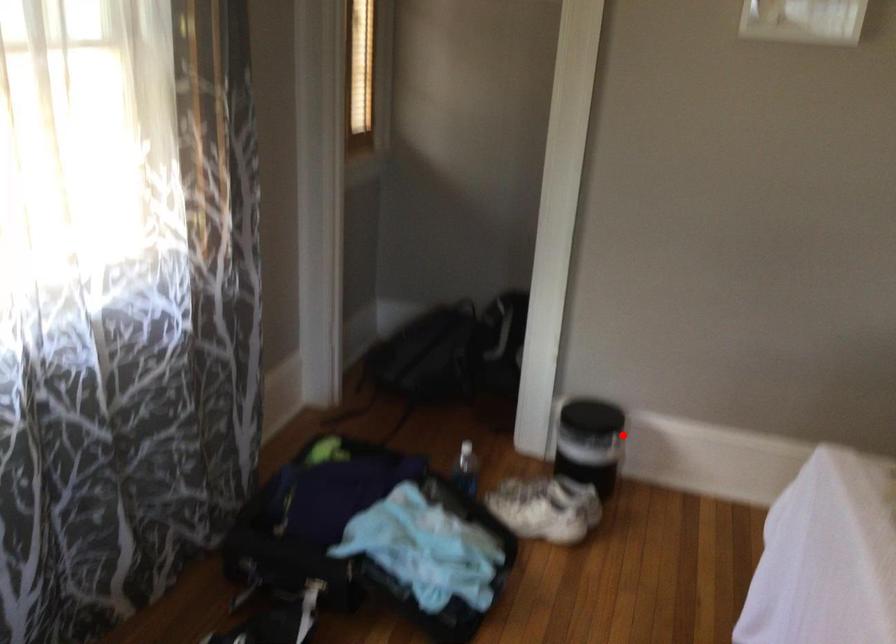
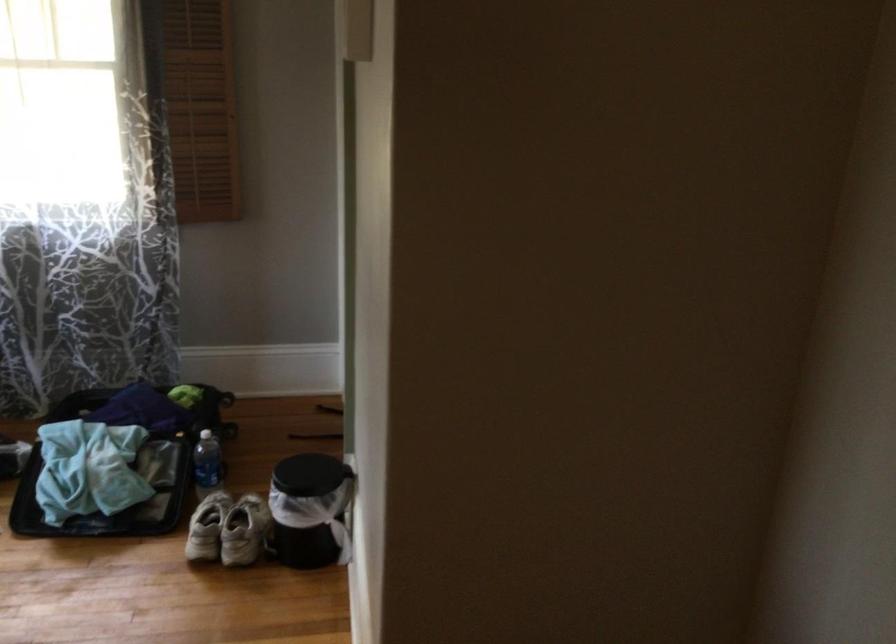
Locate, in the second image, the point that corresponds to the highlighted location in the first image.

(309, 509)